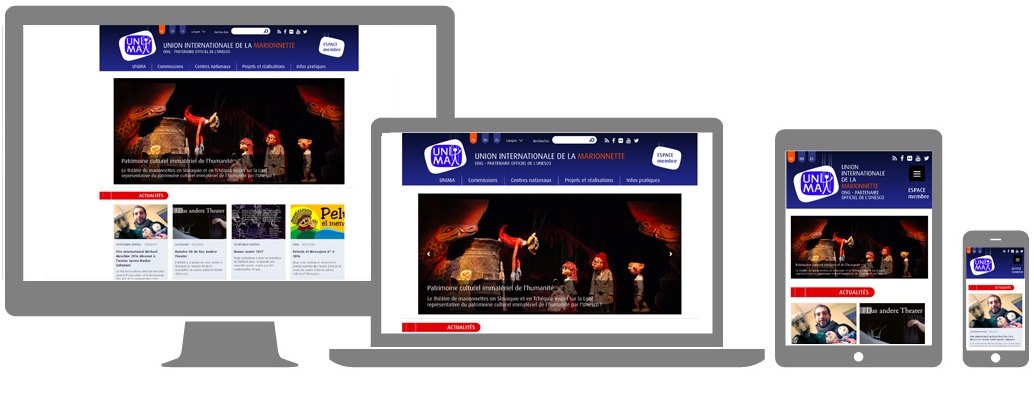
Where is `phone screen`? phone screen is located at coordinates (1003, 336).